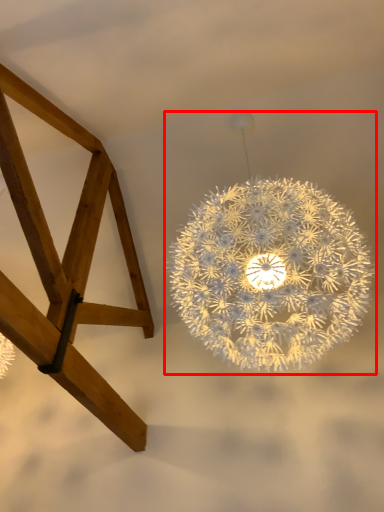
Question: From the image, what is the correct spatial relationship of lamp (annotated by the red box) in relation to furniture?

Choices:
 (A) right
 (B) left

Answer: (A)